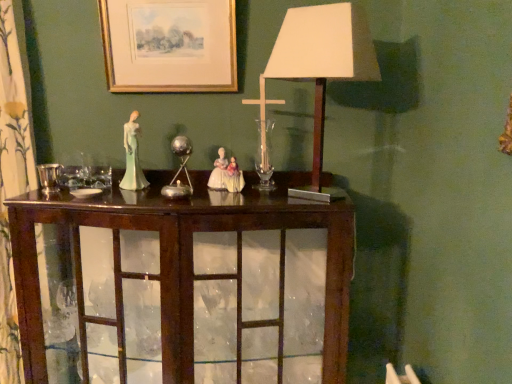
Locate an element on the screen. The width and height of the screenshot is (512, 384). white paper lampshade at center is located at coordinates (321, 67).

Identify the location of mahogany cabinet at center. Image resolution: width=512 pixels, height=384 pixels. (181, 265).

I want to click on gold-framed print at upper center, so click(169, 45).

Identify the location of metallic silver candle holder at center, positioned as the first candle holder in back-to-front order. (179, 169).

Considering the sizes of objects gold-framed print at upper center and shiny silver candle holder at left, the 1th candle holder from the front, in the image provided, who is smaller, gold-framed print at upper center or shiny silver candle holder at left, the 1th candle holder from the front,?

shiny silver candle holder at left, the 1th candle holder from the front, is smaller.

You are a GUI agent. You are given a task and a screenshot of the screen. Output one action in this format:
    pyautogui.click(x=<x>, y=<y>)
    Task: Click on the picture frame that appears behind the shiny silver candle holder at left, marked as the second candle holder in a back-to-front arrangement
    
    Given the screenshot: What is the action you would take?
    pyautogui.click(x=169, y=45)

From a real-world perspective, who is located higher, gold-framed print at upper center or shiny silver candle holder at left, the first candle holder viewed from the left?

gold-framed print at upper center is physically above.

Are gold-framed print at upper center and shiny silver candle holder at left, the first candle holder viewed from the left, far apart?

No.

Is mahogany cabinet at center positioned before porcelain figure at center?

Yes, mahogany cabinet at center is closer to the viewer.

Is mahogany cabinet at center positioned beyond the bounds of porcelain figure at center?

mahogany cabinet at center lies outside porcelain figure at center's area.

Would you say mahogany cabinet at center is a long distance from porcelain figure at center?

mahogany cabinet at center is actually quite close to porcelain figure at center.

From a real-world perspective, is mahogany cabinet at center over porcelain figure at center?

No, from a real-world perspective, mahogany cabinet at center is not on top of porcelain figure at center.

Considering the relative sizes of shiny silver candle holder at left, marked as the second candle holder in a right-to-left arrangement, and white paper lampshade at center in the image provided, is shiny silver candle holder at left, marked as the second candle holder in a right-to-left arrangement, wider than white paper lampshade at center?

No, shiny silver candle holder at left, marked as the second candle holder in a right-to-left arrangement, is not wider than white paper lampshade at center.

From a real-world perspective, relative to white paper lampshade at center, is shiny silver candle holder at left, the first candle holder viewed from the left, vertically above or below?

Clearly, from a real-world perspective, shiny silver candle holder at left, the first candle holder viewed from the left, is below white paper lampshade at center.

How distant is shiny silver candle holder at left, marked as the second candle holder in a back-to-front arrangement, from white paper lampshade at center?

shiny silver candle holder at left, marked as the second candle holder in a back-to-front arrangement, is 79.26 centimeters away from white paper lampshade at center.

Is shiny silver candle holder at left, the 1th candle holder from the front, bigger or smaller than white paper lampshade at center?

Clearly, shiny silver candle holder at left, the 1th candle holder from the front, is smaller in size than white paper lampshade at center.

Would you say metallic silver candle holder at center, positioned as the first candle holder in back-to-front order, is outside mahogany cabinet at center?

Yes, metallic silver candle holder at center, positioned as the first candle holder in back-to-front order, is not within mahogany cabinet at center.

How different are the orientations of metallic silver candle holder at center, marked as the 2th candle holder in a front-to-back arrangement, and mahogany cabinet at center in degrees?

They differ by 0.0896 degrees in their facing directions.

Is metallic silver candle holder at center, marked as the 2th candle holder in a front-to-back arrangement, placed right next to mahogany cabinet at center?

No, metallic silver candle holder at center, marked as the 2th candle holder in a front-to-back arrangement, is not making contact with mahogany cabinet at center.

Between metallic silver candle holder at center, positioned as the first candle holder in back-to-front order, and mahogany cabinet at center, which one has smaller width?

metallic silver candle holder at center, positioned as the first candle holder in back-to-front order, is thinner.

From the image's perspective, is porcelain figure at center above or below mahogany cabinet at center?

From the image's perspective, porcelain figure at center appears above mahogany cabinet at center.

Consider the image. From a real-world perspective, is porcelain figure at center physically below mahogany cabinet at center?

No, from a real-world perspective, porcelain figure at center is not below mahogany cabinet at center.

Does porcelain figure at center lie behind mahogany cabinet at center?

Yes, porcelain figure at center is further from the camera.

Is gold-framed print at upper center further to the viewer compared to porcelain figure at center?

Yes, it is.

Is gold-framed print at upper center to the left or to the right of porcelain figure at center in the image?

In the image, gold-framed print at upper center appears on the right side of porcelain figure at center.

From a real-world perspective, which is physically above, porcelain figure at center or white paper lampshade at center?

white paper lampshade at center.

Is white paper lampshade at center a part of porcelain figure at center?

No.

From the image's perspective, does porcelain figure at center appear higher than white paper lampshade at center?

No, from the image's perspective, porcelain figure at center is not above white paper lampshade at center.

This screenshot has height=384, width=512. In order to click on table lamp in front of the porcelain figure at center in this screenshot , I will do `click(321, 67)`.

This screenshot has width=512, height=384. Identify the location of picture frame behind the shiny silver candle holder at left, marked as the second candle holder in a right-to-left arrangement. (169, 45).

Where is `person that appears on the left of mahogany cabinet at center`? person that appears on the left of mahogany cabinet at center is located at coordinates (132, 157).

Considering their positions, is metallic silver candle holder at center, marked as the 2th candle holder in a front-to-back arrangement, positioned closer to gold-framed print at upper center than porcelain figure at center?

porcelain figure at center lies closer to gold-framed print at upper center than the other object.

Looking at the image, which one is located further to porcelain figure at center, white paper lampshade at center or mahogany cabinet at center?

The object further to porcelain figure at center is white paper lampshade at center.

When comparing their distances from white paper lampshade at center, does porcelain figure at center or mahogany cabinet at center seem further?

porcelain figure at center is further to white paper lampshade at center.

Considering their positions, is shiny silver candle holder at left, the first candle holder viewed from the left, positioned further to metallic silver candle holder at center, arranged as the 2th candle holder when viewed from the left, than mahogany cabinet at center?

shiny silver candle holder at left, the first candle holder viewed from the left.

Looking at the image, which one is located further to porcelain figure at center, gold-framed print at upper center or shiny silver candle holder at left, the first candle holder viewed from the left?

Based on the image, gold-framed print at upper center appears to be further to porcelain figure at center.

In the scene shown: Looking at the image, which one is located closer to gold-framed print at upper center, porcelain figure at center or white paper lampshade at center?

porcelain figure at center.

Looking at the image, which one is located further to shiny silver candle holder at left, the first candle holder viewed from the left, metallic silver candle holder at center, arranged as the 2th candle holder when viewed from the left, or mahogany cabinet at center?

The object further to shiny silver candle holder at left, the first candle holder viewed from the left, is mahogany cabinet at center.

Considering their positions, is mahogany cabinet at center positioned closer to metallic silver candle holder at center, which is the first candle holder in right-to-left order, than white paper lampshade at center?

mahogany cabinet at center is positioned closer to the anchor metallic silver candle holder at center, which is the first candle holder in right-to-left order.

Find the location of a particular element. picture frame between porcelain figure at center and white paper lampshade at center in the horizontal direction is located at coordinates (169, 45).

What are the coordinates of `candle holder between porcelain figure at center and white paper lampshade at center from left to right` in the screenshot? It's located at (179, 169).

This screenshot has height=384, width=512. Find the location of `table lamp between gold-framed print at upper center and mahogany cabinet at center vertically`. table lamp between gold-framed print at upper center and mahogany cabinet at center vertically is located at coordinates (321, 67).

Where is `candle holder located between shiny silver candle holder at left, the 1th candle holder from the front, and white paper lampshade at center in the left-right direction`? This screenshot has height=384, width=512. candle holder located between shiny silver candle holder at left, the 1th candle holder from the front, and white paper lampshade at center in the left-right direction is located at coordinates (179, 169).